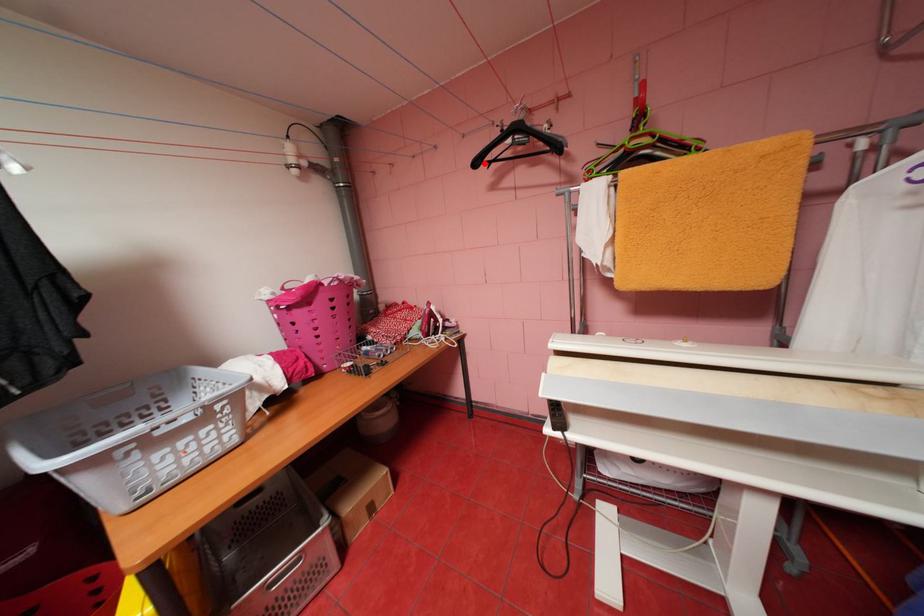
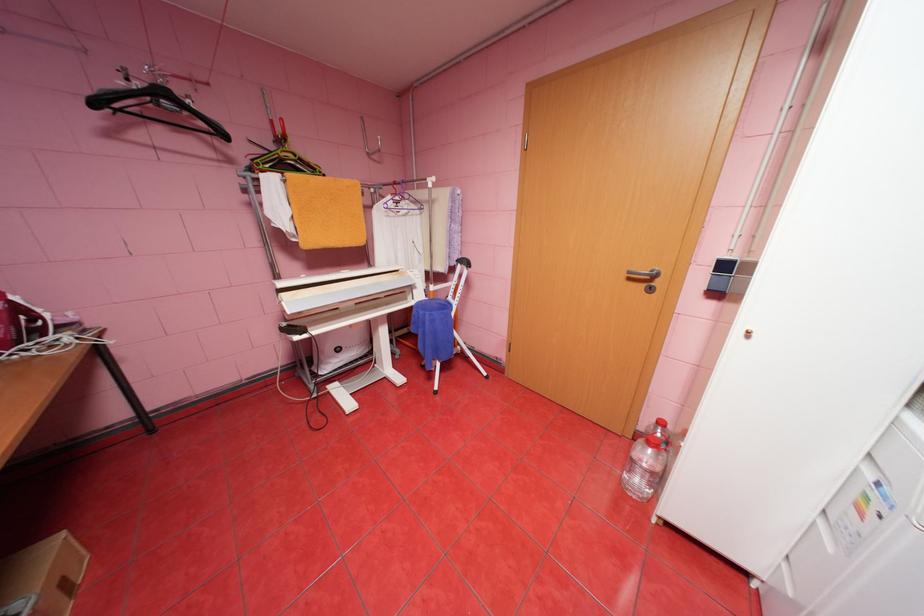
Question: I am providing you with two images of the same scene from different viewpoints. Image1 has a red point marked. In image2, the corresponding 3D location appears at what relative position? Reply with the corresponding letter.

Choices:
 (A) Closer
 (B) Farther

Answer: (B)